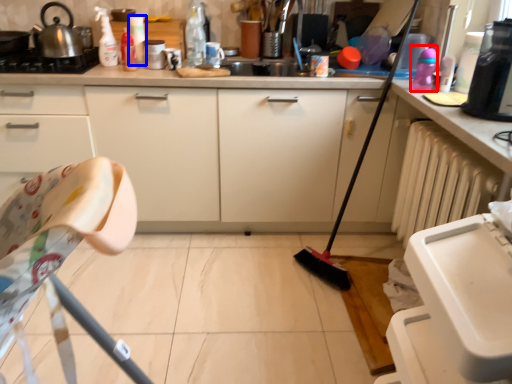
Question: Among these objects, which one is farthest to the camera, toy (highlighted by a red box) or bottle (highlighted by a blue box)?

Choices:
 (A) toy
 (B) bottle

Answer: (B)